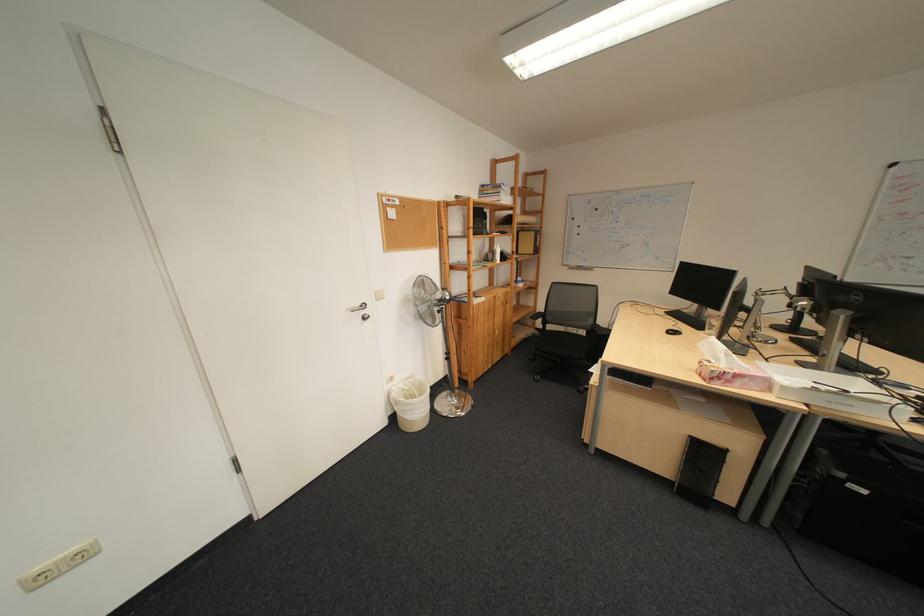
Find where to turn the silver door handle. Please return your answer as a coordinate pair (x, y).

(360, 310)